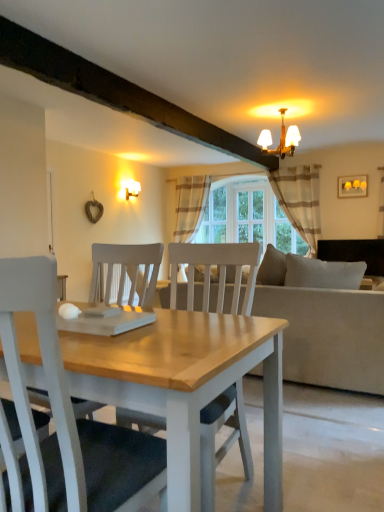
Identify the location of brown striped curtain at center, the second curtain positioned from the right. This screenshot has width=384, height=512. (190, 206).

Where is `beige fabric couch at center`? The image size is (384, 512). beige fabric couch at center is located at coordinates (328, 335).

What is the approximate height of matte yellow picture frame at upper right?

A: The height of matte yellow picture frame at upper right is 12.80 inches.

Locate an element on the screen. Image resolution: width=384 pixels, height=512 pixels. white painted wood chair at center is located at coordinates (70, 416).

The width and height of the screenshot is (384, 512). In order to click on clear glass door at center in this screenshot , I will do [250, 215].

Is brown striped curtain at center, placed as the 2th curtain when sorted from front to back, to the right of white painted wood chair at center from the viewer's perspective?

Correct, you'll find brown striped curtain at center, placed as the 2th curtain when sorted from front to back, to the right of white painted wood chair at center.

Does brown striped curtain at center, the 1th curtain viewed from the left, turn towards white painted wood chair at center?

No, brown striped curtain at center, the 1th curtain viewed from the left, does not turn towards white painted wood chair at center.

Which of these two, brown striped curtain at center, the second curtain positioned from the right, or white painted wood chair at center, stands taller?

brown striped curtain at center, the second curtain positioned from the right, is taller.

Is point (197, 207) positioned behind point (63, 431)?

Yes, it is behind point (63, 431).

Is matte yellow picture frame at upper right outside of clear glass door at center?

Yes, matte yellow picture frame at upper right is located beyond the bounds of clear glass door at center.

In terms of width, does matte yellow picture frame at upper right look wider or thinner when compared to clear glass door at center?

Considering their sizes, matte yellow picture frame at upper right looks slimmer than clear glass door at center.

From a real-world perspective, is matte yellow picture frame at upper right over clear glass door at center?

Yes, from a real-world perspective, matte yellow picture frame at upper right is over clear glass door at center

Does matte yellow picture frame at upper right have a larger size compared to clear glass door at center?

Incorrect, matte yellow picture frame at upper right is not larger than clear glass door at center.

Considering the positions of objects beige striped fabric curtain at upper right, placed as the 2th curtain when sorted from back to front, and brown striped curtain at center, which is counted as the first curtain, starting from the back, in the image provided, who is more to the left, beige striped fabric curtain at upper right, placed as the 2th curtain when sorted from back to front, or brown striped curtain at center, which is counted as the first curtain, starting from the back,?

Positioned to the left is brown striped curtain at center, which is counted as the first curtain, starting from the back.

Is beige striped fabric curtain at upper right, the second curtain in the left-to-right sequence, next to brown striped curtain at center, the 1th curtain viewed from the left, and touching it?

There is a gap between beige striped fabric curtain at upper right, the second curtain in the left-to-right sequence, and brown striped curtain at center, the 1th curtain viewed from the left.

Based on the photo, from the image's perspective, which is below, beige striped fabric curtain at upper right, marked as the 1th curtain in a front-to-back arrangement, or brown striped curtain at center, the second curtain positioned from the right?

beige striped fabric curtain at upper right, marked as the 1th curtain in a front-to-back arrangement.

Between beige striped fabric curtain at upper right, placed as the 2th curtain when sorted from back to front, and white painted wood chair at center, which one has smaller size?

With smaller size is white painted wood chair at center.

In the scene shown: From a real-world perspective, which is physically above, beige striped fabric curtain at upper right, the second curtain in the left-to-right sequence, or white painted wood chair at center?

beige striped fabric curtain at upper right, the second curtain in the left-to-right sequence, is physically above.

Is there a large distance between beige striped fabric curtain at upper right, the second curtain in the left-to-right sequence, and white painted wood chair at center?

beige striped fabric curtain at upper right, the second curtain in the left-to-right sequence, is far away from white painted wood chair at center.

Is beige striped fabric curtain at upper right, which is the first curtain in right-to-left order, inside or outside of white painted wood chair at center?

beige striped fabric curtain at upper right, which is the first curtain in right-to-left order, is spatially situated outside white painted wood chair at center.

Find the location of `the 2nd lamp positioned above the beige striped fabric curtain at upper right, the second curtain in the left-to-right sequence (from a real-world perspective)`. the 2nd lamp positioned above the beige striped fabric curtain at upper right, the second curtain in the left-to-right sequence (from a real-world perspective) is located at coordinates (280, 139).

Is beige striped fabric curtain at upper right, placed as the 2th curtain when sorted from back to front, smaller than white glass chandelier at upper center, the first lamp viewed from the right?

No.

How different are the orientations of beige striped fabric curtain at upper right, marked as the 1th curtain in a front-to-back arrangement, and white glass chandelier at upper center, the first lamp viewed from the right, in degrees?

0.00469 degrees.

From the image's perspective, between beige striped fabric curtain at upper right, placed as the 2th curtain when sorted from back to front, and white glass chandelier at upper center, placed as the 1th lamp when sorted from front to back, who is located below?

beige striped fabric curtain at upper right, placed as the 2th curtain when sorted from back to front, is shown below in the image.

Is brown striped curtain at center, the second curtain positioned from the right, far from clear glass door at center?

No, brown striped curtain at center, the second curtain positioned from the right, is not far from clear glass door at center.

Find the location of a particular element. glass door to the right of brown striped curtain at center, which is counted as the first curtain, starting from the back is located at coordinates (250, 215).

Is brown striped curtain at center, the second curtain positioned from the right, looking in the opposite direction of clear glass door at center?

No.

From a real-world perspective, is brown striped curtain at center, placed as the 2th curtain when sorted from front to back, above or below clear glass door at center?

In terms of real-world spatial position, brown striped curtain at center, placed as the 2th curtain when sorted from front to back, is above clear glass door at center.

Is beige fabric couch at center turned away from matte yellow picture frame at upper right?

No, matte yellow picture frame at upper right is not at the back of beige fabric couch at center.

Is beige fabric couch at center in front of or behind matte yellow picture frame at upper right in the image?

Visually, beige fabric couch at center is located in front of matte yellow picture frame at upper right.

From the image's perspective, who appears lower, beige fabric couch at center or matte yellow picture frame at upper right?

beige fabric couch at center appears lower in the image.

Does beige fabric couch at center have a smaller size compared to matte yellow picture frame at upper right?

Incorrect, beige fabric couch at center is not smaller in size than matte yellow picture frame at upper right.

Locate an element on the screen. curtain that is the 2nd one above the white painted wood chair at center (from a real-world perspective) is located at coordinates (190, 206).

This screenshot has width=384, height=512. Identify the location of picture frame that is above the clear glass door at center (from the image's perspective). (352, 186).

Consider the image. Looking at the image, which one is located further to brown striped curtain at center, which is counted as the first curtain, starting from the back, beige striped fabric curtain at upper right, marked as the 1th curtain in a front-to-back arrangement, or matte white wall sconce at upper left, which is the 1th lamp from back to front?

beige striped fabric curtain at upper right, marked as the 1th curtain in a front-to-back arrangement, is positioned further to the anchor brown striped curtain at center, which is counted as the first curtain, starting from the back.

Which object lies nearer to the anchor point matte white wall sconce at upper left, which is the 1th lamp from back to front, white painted wood chair at center or brown striped curtain at center, which is counted as the first curtain, starting from the back?

Among the two, brown striped curtain at center, which is counted as the first curtain, starting from the back, is located nearer to matte white wall sconce at upper left, which is the 1th lamp from back to front.

From the image, which object appears to be nearer to white glass chandelier at upper center, which is the 2th lamp in back-to-front order, beige fabric couch at center or white painted wood chair at center?

Among the two, beige fabric couch at center is located nearer to white glass chandelier at upper center, which is the 2th lamp in back-to-front order.

Based on their spatial positions, is white glass chandelier at upper center, the 2th lamp positioned from the left, or white painted wood chair at center further from beige fabric couch at center?

The object further to beige fabric couch at center is white glass chandelier at upper center, the 2th lamp positioned from the left.

From the picture: Which object lies further to the anchor point beige fabric couch at center, clear glass door at center or brown striped curtain at center, the second curtain positioned from the right?

Based on the image, brown striped curtain at center, the second curtain positioned from the right, appears to be further to beige fabric couch at center.

Based on their spatial positions, is beige striped fabric curtain at upper right, placed as the 2th curtain when sorted from back to front, or brown striped curtain at center, the second curtain positioned from the right, further from beige fabric couch at center?

Based on the image, brown striped curtain at center, the second curtain positioned from the right, appears to be further to beige fabric couch at center.

Which object lies further to the anchor point beige striped fabric curtain at upper right, which is the first curtain in right-to-left order, matte yellow picture frame at upper right or matte white wall sconce at upper left, which is the 1th lamp from back to front?

Among the two, matte white wall sconce at upper left, which is the 1th lamp from back to front, is located further to beige striped fabric curtain at upper right, which is the first curtain in right-to-left order.

When comparing their distances from clear glass door at center, does matte yellow picture frame at upper right or beige striped fabric curtain at upper right, marked as the 1th curtain in a front-to-back arrangement, seem further?

matte yellow picture frame at upper right.

This screenshot has height=512, width=384. What are the coordinates of `studio couch between white painted wood chair at center and matte yellow picture frame at upper right in the front-back direction` in the screenshot? It's located at click(328, 335).

Identify the location of picture frame between white painted wood chair at center and beige striped fabric curtain at upper right, marked as the 1th curtain in a front-to-back arrangement, along the z-axis. (352, 186).

Where is `curtain positioned between white glass chandelier at upper center, the 2th lamp positioned from the left, and matte white wall sconce at upper left, positioned as the 2th lamp in right-to-left order, from near to far`? This screenshot has width=384, height=512. curtain positioned between white glass chandelier at upper center, the 2th lamp positioned from the left, and matte white wall sconce at upper left, positioned as the 2th lamp in right-to-left order, from near to far is located at coordinates (300, 200).

You are a GUI agent. You are given a task and a screenshot of the screen. Output one action in this format:
    pyautogui.click(x=<x>, y=<y>)
    Task: Click on the studio couch between white painted wood chair at center and clear glass door at center in the front-back direction
    The height and width of the screenshot is (512, 384).
    Given the screenshot: What is the action you would take?
    pyautogui.click(x=328, y=335)